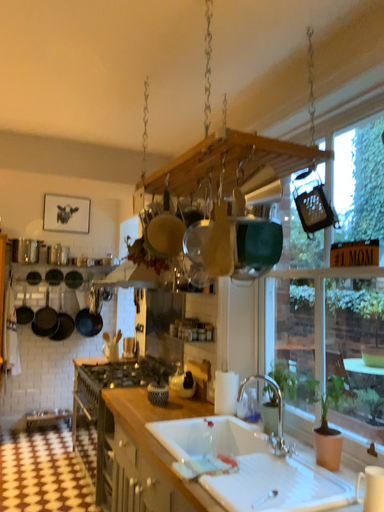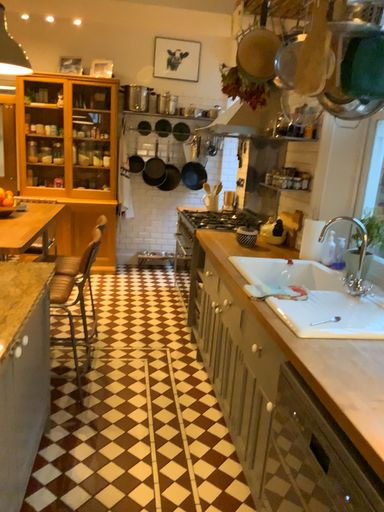
Question: Which way did the camera rotate in the video?

Choices:
 (A) rotated right
 (B) rotated left

Answer: (B)